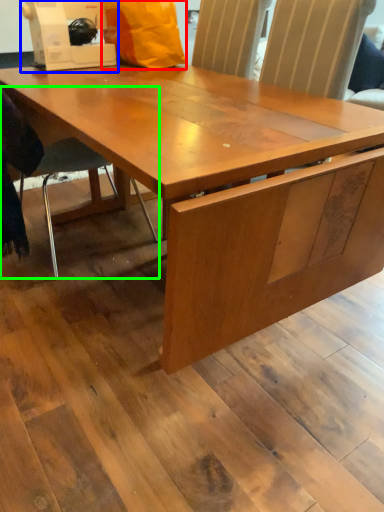
Question: Which is farther away from paper bag (highlighted by a red box)? sewing machine (highlighted by a blue box) or chair (highlighted by a green box)?

Choices:
 (A) sewing machine
 (B) chair

Answer: (B)